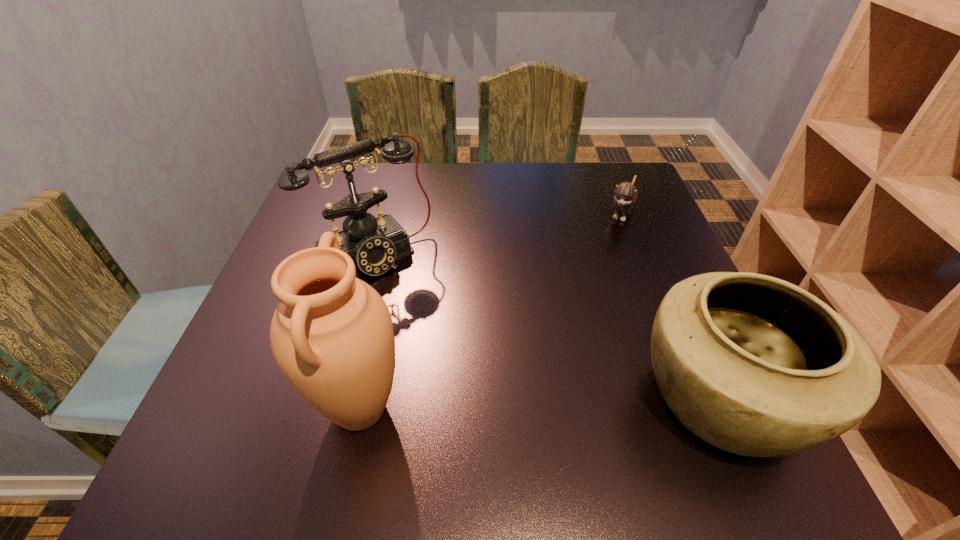
Locate an element on the screen. free space located 0.390m on the dial of the telephone is located at coordinates (514, 417).

The image size is (960, 540). In order to click on vacant space located 0.180m on the dial of the telephone in this screenshot , I will do `click(445, 334)`.

Image resolution: width=960 pixels, height=540 pixels. Identify the location of object present at the far edge. (625, 196).

Identify the location of urn that is at the near edge. (332, 336).

This screenshot has width=960, height=540. Identify the location of pottery at the near edge. (754, 365).

This screenshot has height=540, width=960. Identify the location of object located at the left edge. (374, 244).

The width and height of the screenshot is (960, 540). I want to click on pottery present at the right edge, so click(x=754, y=365).

I want to click on kitten that is at the right edge, so click(625, 196).

At what (x,y) coordinates should I click in order to perform the action: click on object located at the far right corner. Please return your answer as a coordinate pair (x, y). The height and width of the screenshot is (540, 960). Looking at the image, I should click on (625, 196).

Identify the location of object at the near right corner. (754, 365).